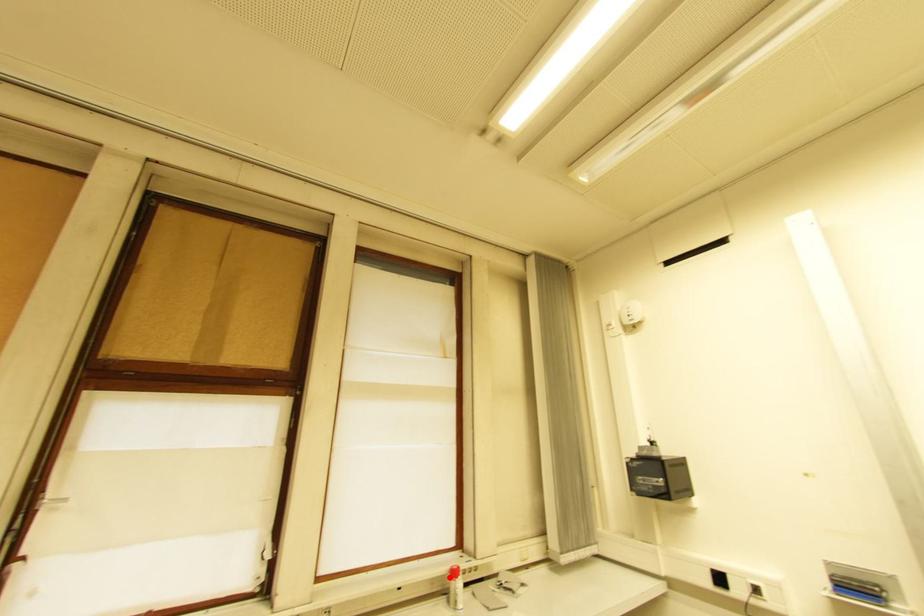
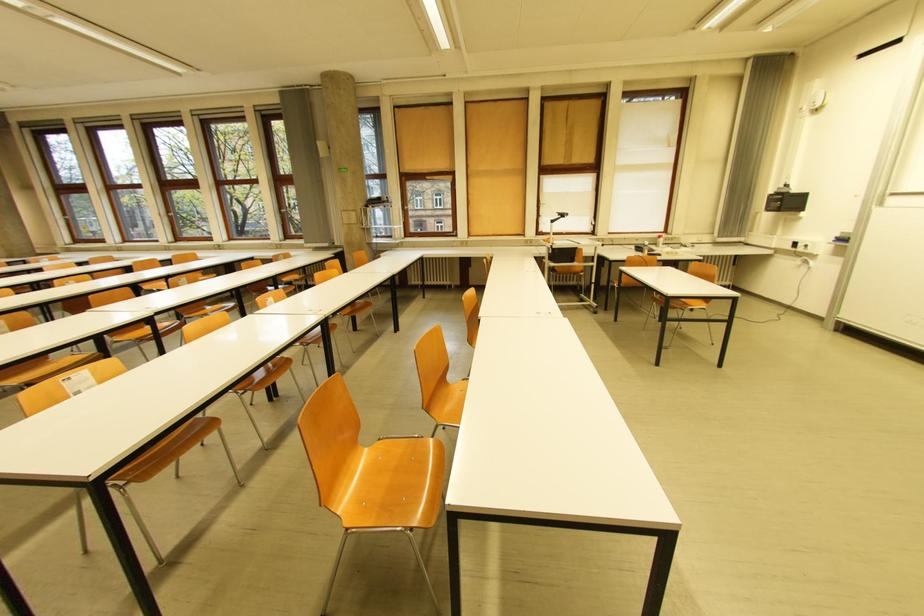
Find the pixel in the second image that matches the highlighted location in the first image.

(662, 240)